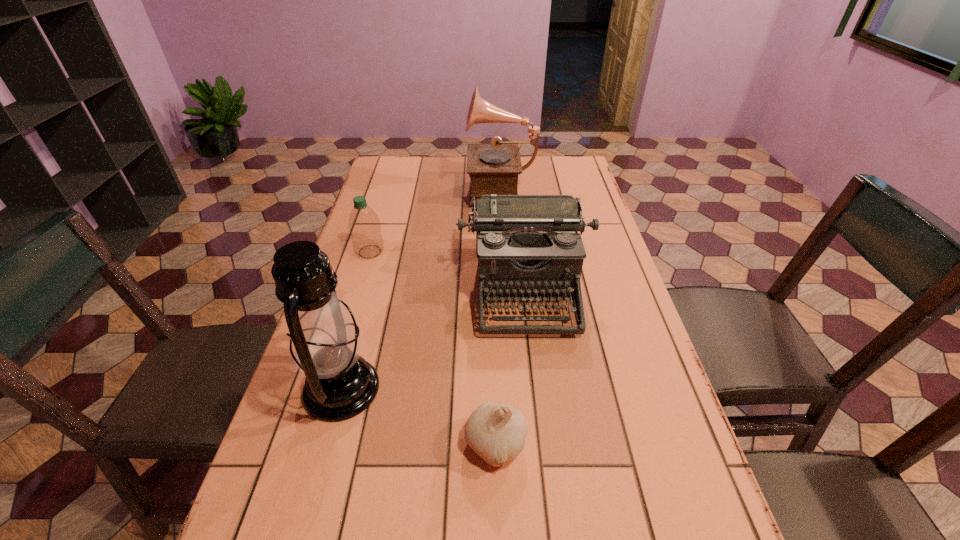
Where is `empty location between the garlic and the third shortest object`? This screenshot has width=960, height=540. empty location between the garlic and the third shortest object is located at coordinates (511, 367).

The width and height of the screenshot is (960, 540). In order to click on free space between the garlic and the second shortest object in this screenshot , I will do `click(433, 348)`.

Where is `empty location between the farthest object and the shortest object`? This screenshot has height=540, width=960. empty location between the farthest object and the shortest object is located at coordinates [x=499, y=316].

At what (x,y) coordinates should I click in order to perform the action: click on free space between the oil lamp and the shortest object. Please return your answer as a coordinate pair (x, y). The height and width of the screenshot is (540, 960). Looking at the image, I should click on (419, 416).

Locate which object is the closest to the farthest object. Please provide its 2D coordinates. Your answer should be formatted as a tuple, i.e. [(x, y)], where the tuple contains the x and y coordinates of a point satisfying the conditions above.

[(525, 244)]

Where is `object identified as the fourth closest to the third shortest object`? The width and height of the screenshot is (960, 540). object identified as the fourth closest to the third shortest object is located at coordinates click(x=493, y=169).

At what (x,y) coordinates should I click in order to perform the action: click on blank space that satisfies the following two spatial constraints: 1. on the front side of the oil lamp; 2. on the right side of the garlic. Please return your answer as a coordinate pair (x, y). This screenshot has width=960, height=540. Looking at the image, I should click on (326, 444).